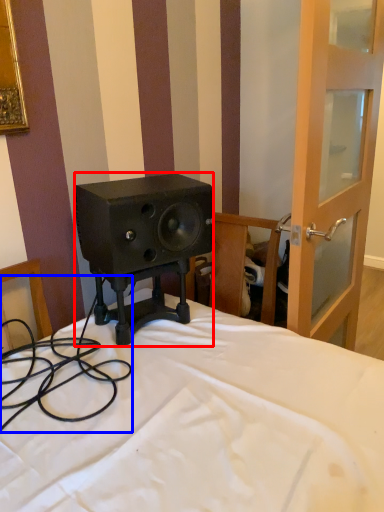
Question: Which point is closer to the camera, loudspeaker (highlighted by a red box) or cable (highlighted by a blue box)?

Choices:
 (A) loudspeaker
 (B) cable

Answer: (B)